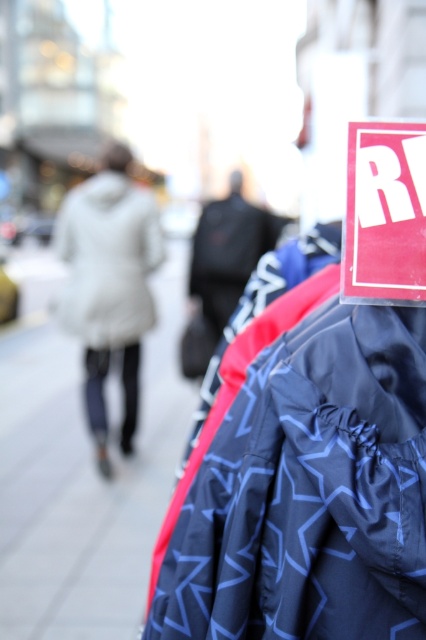
Question: Which point is closer to the camera taking this photo?

Choices:
 (A) (412, 600)
 (B) (391, 288)
 (C) (131, 305)
 (D) (54, 500)

Answer: (A)

Question: In this image, where is white down coat at left located relative to red paper sign at upper right?

Choices:
 (A) left
 (B) right

Answer: (A)

Question: Among these objects, which one is nearest to the camera?

Choices:
 (A) black matte coat at center
 (B) red paper sign at upper right

Answer: (B)

Question: Estimate the real-world distances between objects in this image. Which object is farther from the gray concrete pavement at lower left?

Choices:
 (A) red paper sign at upper right
 (B) white down coat at left
 (C) black matte coat at center
 (D) dark blue textured jacket at right

Answer: (A)

Question: Can you confirm if dark blue textured jacket at right is bigger than white down coat at left?

Choices:
 (A) yes
 (B) no

Answer: (B)

Question: Can you confirm if dark blue textured jacket at right is positioned to the left of red paper sign at upper right?

Choices:
 (A) no
 (B) yes

Answer: (B)